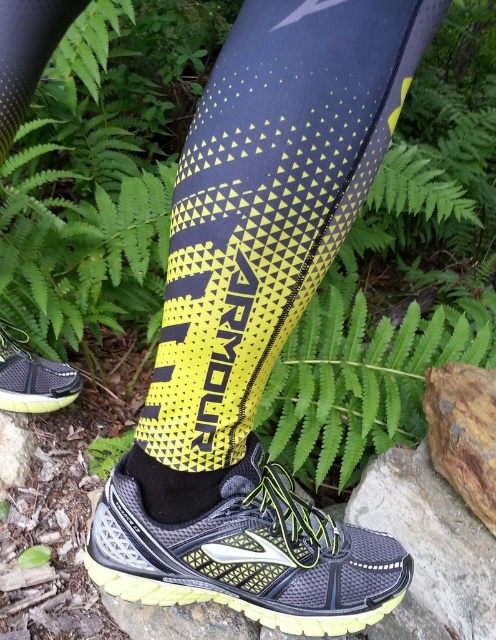
Question: Does matte black shoe at lower left appear under black mesh sock at lower center?

Choices:
 (A) yes
 (B) no

Answer: (B)

Question: Estimate the real-world distances between objects in this image. Which object is farther from the matte black shoe at lower left?

Choices:
 (A) black mesh sock at lower center
 (B) matte black shoe at lower center

Answer: (B)

Question: Is matte black shoe at lower center wider than black mesh sock at lower center?

Choices:
 (A) no
 (B) yes

Answer: (B)

Question: Can you confirm if matte black shoe at lower center is positioned above black mesh sock at lower center?

Choices:
 (A) no
 (B) yes

Answer: (A)

Question: Which point is farther to the camera?

Choices:
 (A) matte black shoe at lower center
 (B) black mesh sock at lower center

Answer: (A)

Question: Among these points, which one is nearest to the camera?

Choices:
 (A) [x=27, y=376]
 (B) [x=367, y=534]
 (C) [x=145, y=483]

Answer: (C)